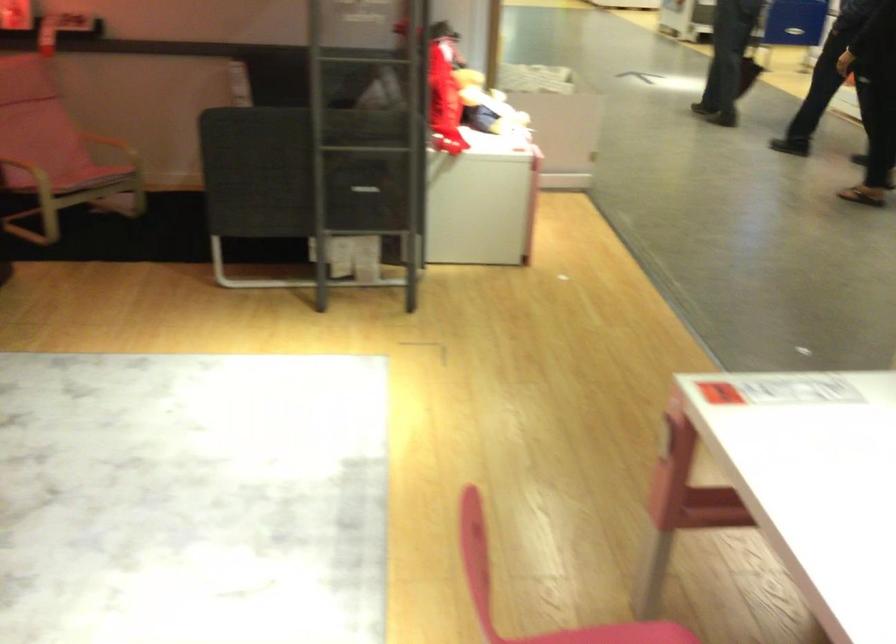
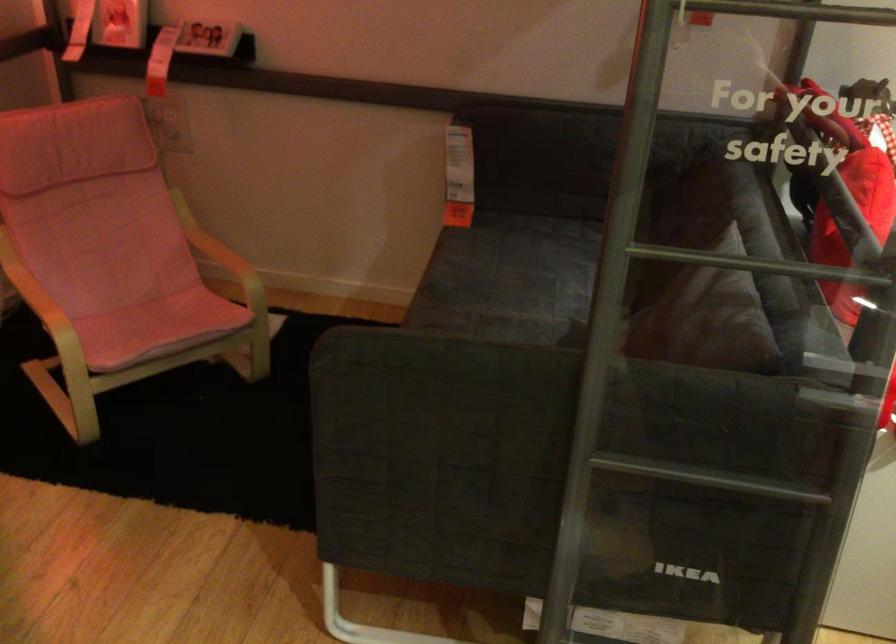
The point at (398, 154) is marked in the first image. Where is the corresponding point in the second image?

(736, 484)